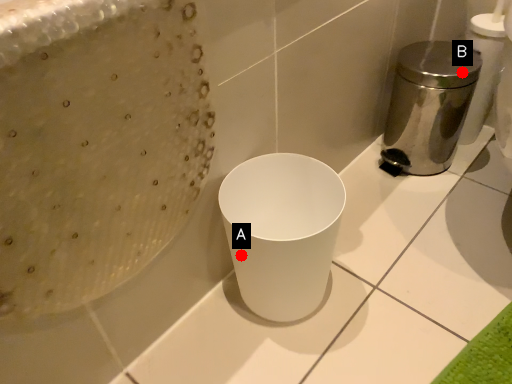
Question: Two points are circled on the image, labeled by A and B beside each circle. Which point appears farthest from the camera in this image?

Choices:
 (A) A is further
 (B) B is further

Answer: (B)